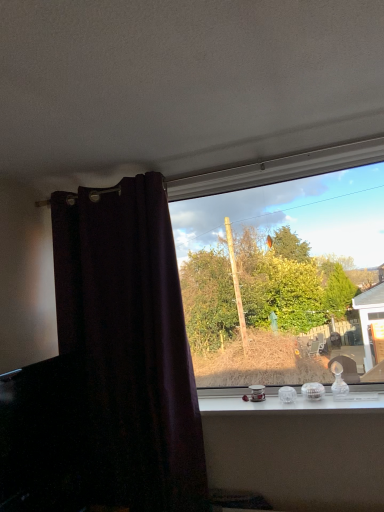
The image size is (384, 512). In order to click on vacant space underneath transparent glass window at center (from a real-world perspective) in this screenshot , I will do `click(282, 398)`.